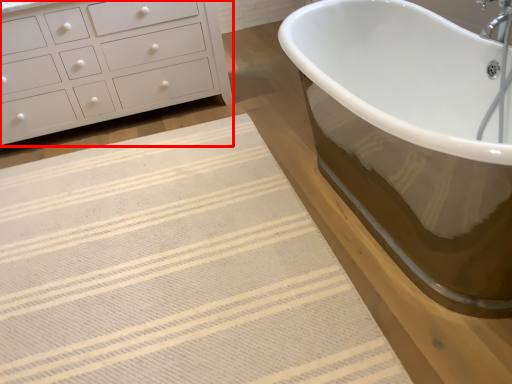
Question: Where is chest of drawers (annotated by the red box) located in relation to bath mat in the image?

Choices:
 (A) right
 (B) left

Answer: (B)